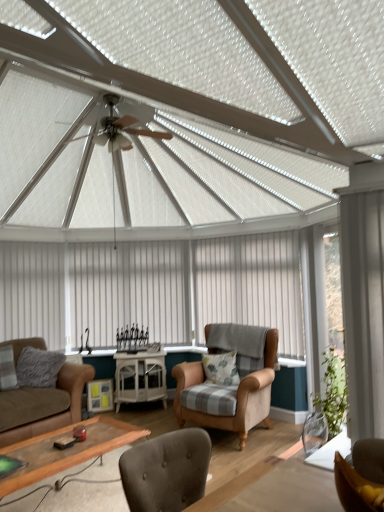
Identify the location of free location above wooden glass coffee table at lower center (from a real-world perspective). (78, 437).